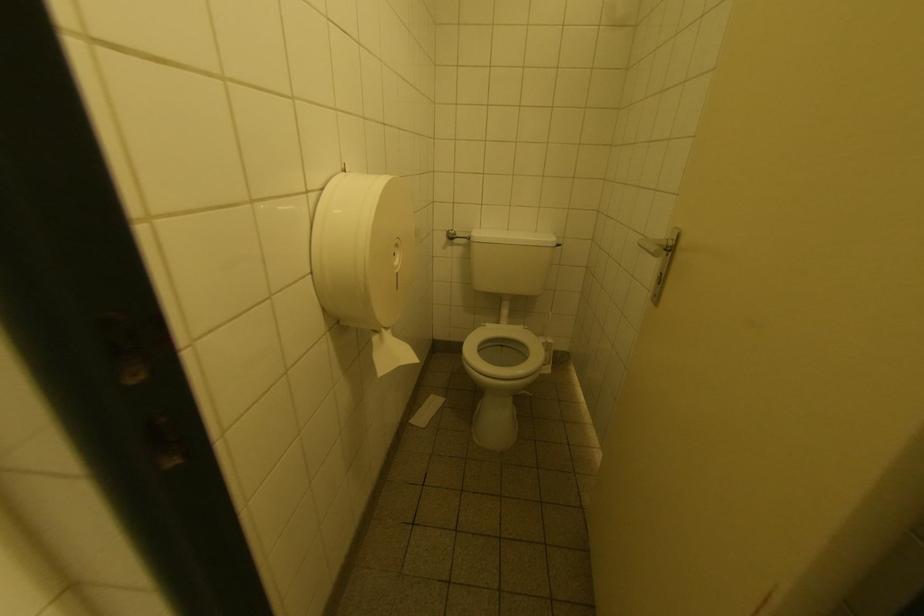
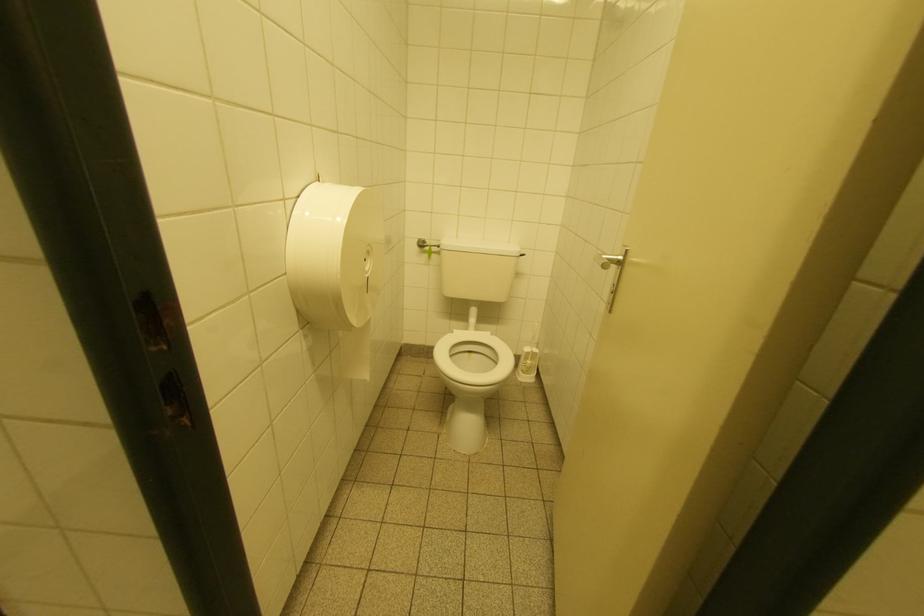
Question: In a continuous first-person perspective shot, in which direction is the camera moving?

Choices:
 (A) Left
 (B) Right
 (C) Forward
 (D) Backward

Answer: (B)